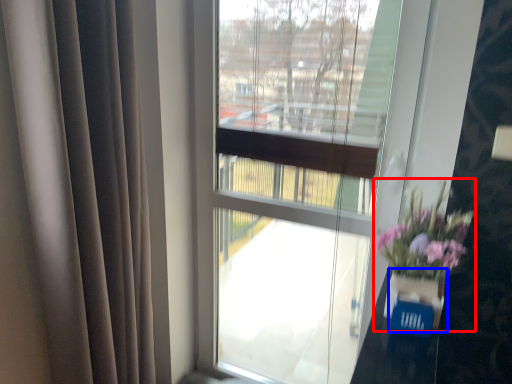
Question: Which object appears closest to the camera in this image, floral arrangement (highlighted by a red box) or glass vase (highlighted by a blue box)?

Choices:
 (A) floral arrangement
 (B) glass vase

Answer: (B)